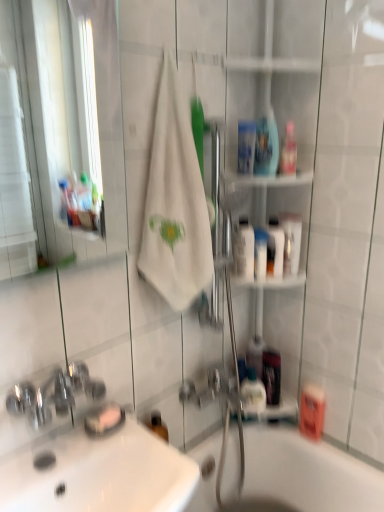
Question: In the image, is white cotton towel at center on the left side or the right side of white glossy sink at lower left?

Choices:
 (A) right
 (B) left

Answer: (A)

Question: Relative to white glossy sink at lower left, is white cotton towel at center in front or behind?

Choices:
 (A) front
 (B) behind

Answer: (B)

Question: Considering the real-world distances, which object is closest to the clear plastic mouthwash at upper center, placed as the 7th mouthwash when sorted from bottom to top?

Choices:
 (A) translucent plastic mouthwash at upper right, which is counted as the 5th mouthwash, starting from the bottom
 (B) translucent plastic mouthwash at lower right, acting as the seventh mouthwash starting from the top
 (C) white cotton towel at center
 (D) white glossy bottle at center-right, arranged as the 4th mouthwash when ordered from the bottom
 (E) white glossy sink at lower left

Answer: (D)

Question: Based on their relative distances, which object is farther from the pink matte mouthwash at lower right, positioned as the first mouthwash in bottom-to-top order?

Choices:
 (A) translucent plastic mouthwash at lower right, acting as the seventh mouthwash starting from the top
 (B) white glossy mouthwash at upper right, the sixth mouthwash positioned from the bottom
 (C) blue plastic mouthwash at upper center, the ninth mouthwash in the bottom-to-top sequence
 (D) translucent plastic mouthwash at right, which is counted as the second mouthwash, starting from the bottom
 (E) clear glass mirror at upper left

Answer: (E)